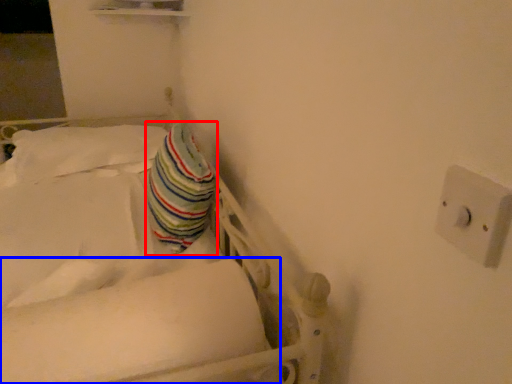
Question: Which object is further to the camera taking this photo, throw pillow (highlighted by a red box) or mattress (highlighted by a blue box)?

Choices:
 (A) throw pillow
 (B) mattress

Answer: (A)